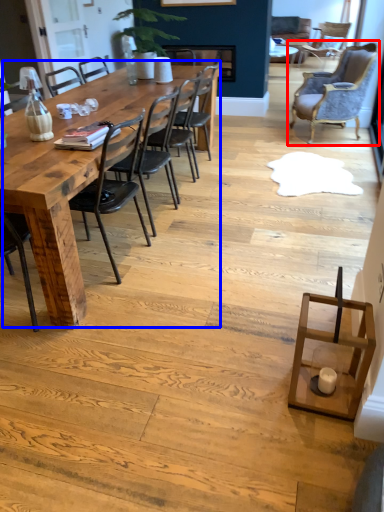
Question: Which object is closer to the camera taking this photo, chair (highlighted by a red box) or kitchen & dining room table (highlighted by a blue box)?

Choices:
 (A) chair
 (B) kitchen & dining room table

Answer: (B)